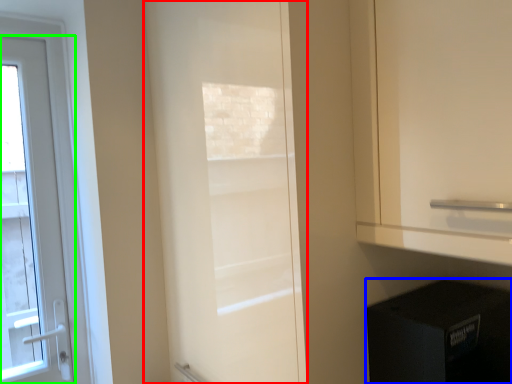
Question: Which object is positioned closest to door (highlighted by a red box)? Select from appliance (highlighted by a blue box) and door (highlighted by a green box).

Choices:
 (A) appliance
 (B) door

Answer: (A)